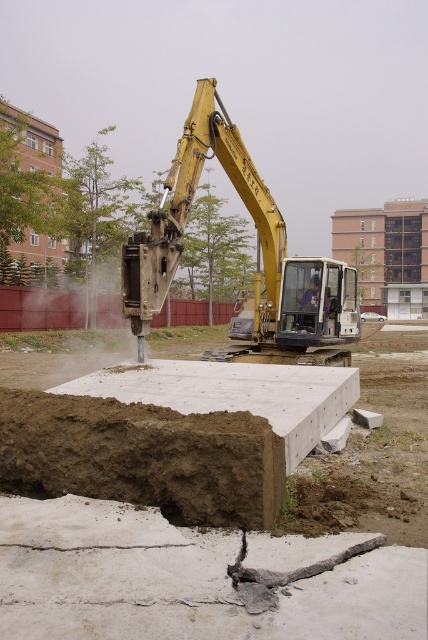
Is point (44, 570) closer to camera compared to point (98, 403)?

Yes, it is.

Between white cracked concrete at center and brown clay dirt at center, which one is positioned higher?

brown clay dirt at center is higher up.

Does point (359, 557) lie behind point (211, 435)?

No, it is in front of (211, 435).

Locate an element on the screen. white cracked concrete at center is located at coordinates (180, 580).

Is point (389, 582) behind point (293, 301)?

No, it is not.

Is white cracked concrete at center closer to the viewer compared to yellow metallic excavator at center?

Yes, white cracked concrete at center is closer to the viewer.

Where is `white cracked concrete at center`? Image resolution: width=428 pixels, height=640 pixels. white cracked concrete at center is located at coordinates (180, 580).

Where is `white cracked concrete at center`? white cracked concrete at center is located at coordinates (180, 580).

Based on the photo, which of these two, white cracked concrete at center or light blue fabric construction worker at center, stands taller?

Standing taller between the two is light blue fabric construction worker at center.

Is point (403, 556) less distant than point (314, 289)?

Yes.

Identify the location of white cracked concrete at center. The width and height of the screenshot is (428, 640). (180, 580).